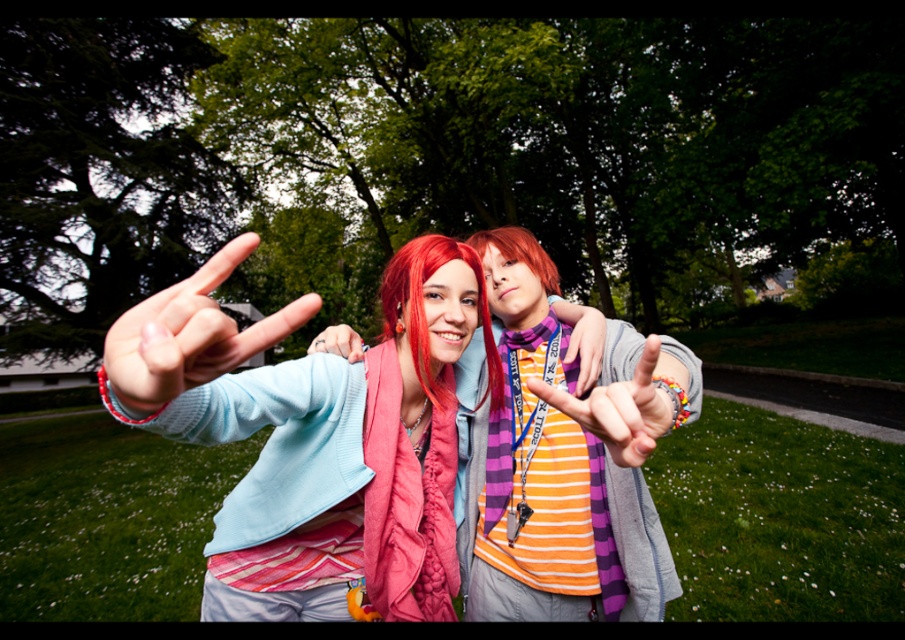
Question: Which point appears farthest from the camera in this image?

Choices:
 (A) (520, 232)
 (B) (159, 323)

Answer: (A)

Question: Is knitted pink scarf at center bigger than matte black hand at center?

Choices:
 (A) no
 (B) yes

Answer: (A)

Question: Considering the real-world distances, which object is closest to the orange striped shirt at center?

Choices:
 (A) knitted pink scarf at center
 (B) green grass at lower center
 (C) matte blue hand at center

Answer: (C)

Question: Considering the real-world distances, which object is farthest from the orange striped shirt at center?

Choices:
 (A) purple striped scarf at center
 (B) matte blue hand at center

Answer: (A)

Question: Is knitted pink scarf at center positioned at the back of matte blue hand at center?

Choices:
 (A) no
 (B) yes

Answer: (B)

Question: Is matte blue hand at center closer to camera compared to purple striped scarf at center?

Choices:
 (A) no
 (B) yes

Answer: (B)